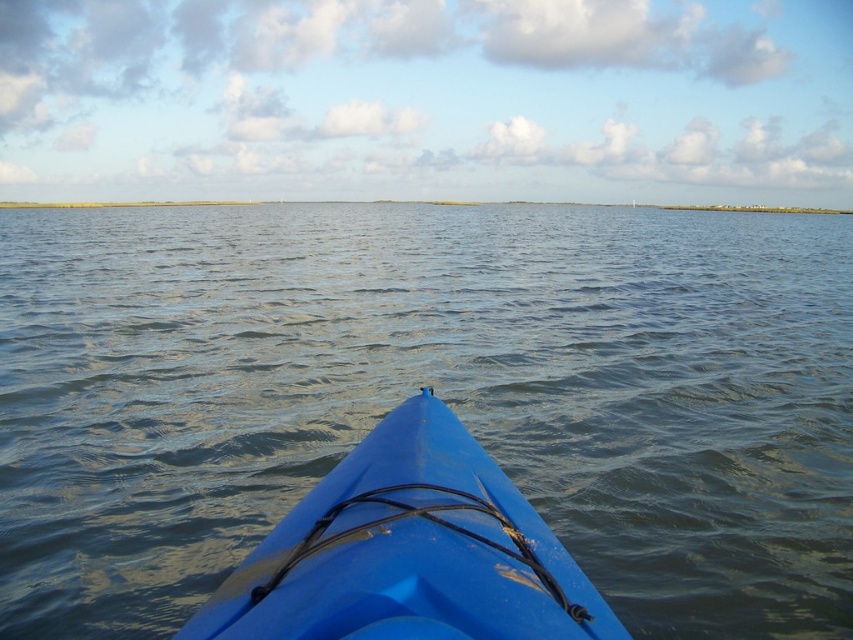
Does blue water at center appear over blue plastic kayak at center?

Yes.

Who is shorter, blue water at center or blue plastic kayak at center?

blue plastic kayak at center

At what (x,y) coordinates should I click in order to perform the action: click on blue water at center. Please return your answer as a coordinate pair (x, y). Looking at the image, I should click on pos(434,392).

Where is `blue water at center`? blue water at center is located at coordinates (434, 392).